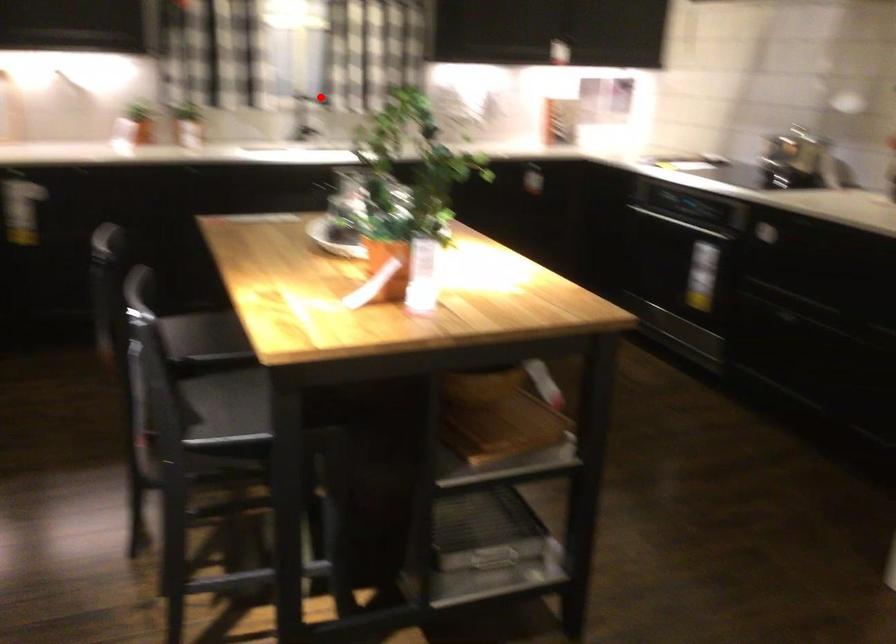
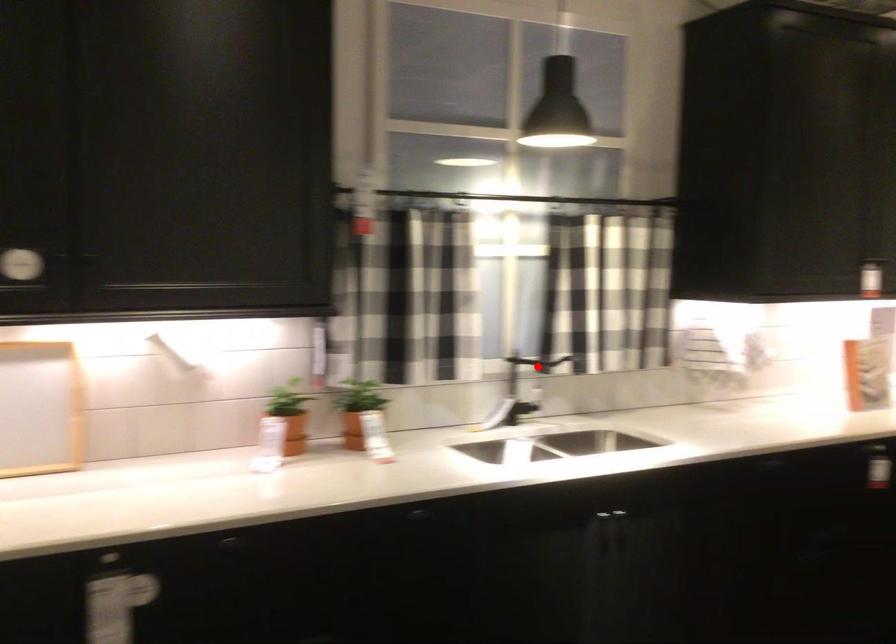
I am providing you with two images of the same scene from different viewpoints. A red point is marked on the first image and another point is marked on the second image. Do the highlighted points in image1 and image2 indicate the same real-world spot?

Yes